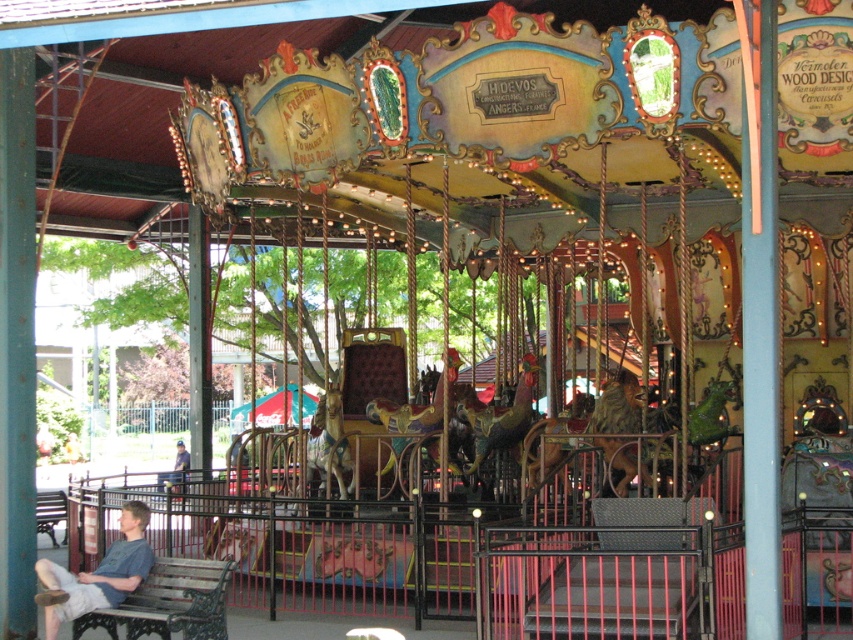
Question: Which point is closer to the camera taking this photo?

Choices:
 (A) (169, 490)
 (B) (50, 529)
 (C) (141, 627)

Answer: (C)

Question: Is wooden bench at lower left to the right of light blue t-shirt at lower left from the viewer's perspective?

Choices:
 (A) yes
 (B) no

Answer: (A)

Question: Estimate the real-world distances between objects in this image. Which object is closer to the wooden bench at lower left?

Choices:
 (A) light blue t-shirt at lower left
 (B) light blue denim jeans at lower left
 (C) wooden park bench at lower left

Answer: (A)

Question: Which object is the farthest from the light blue denim jeans at lower left?

Choices:
 (A) wooden bench at lower left
 (B) wooden park bench at lower left
 (C) light blue t-shirt at lower left

Answer: (B)

Question: Is wooden park bench at lower left to the left of light blue denim jeans at lower left from the viewer's perspective?

Choices:
 (A) no
 (B) yes

Answer: (B)

Question: Can you confirm if light blue t-shirt at lower left is thinner than wooden park bench at lower left?

Choices:
 (A) yes
 (B) no

Answer: (B)